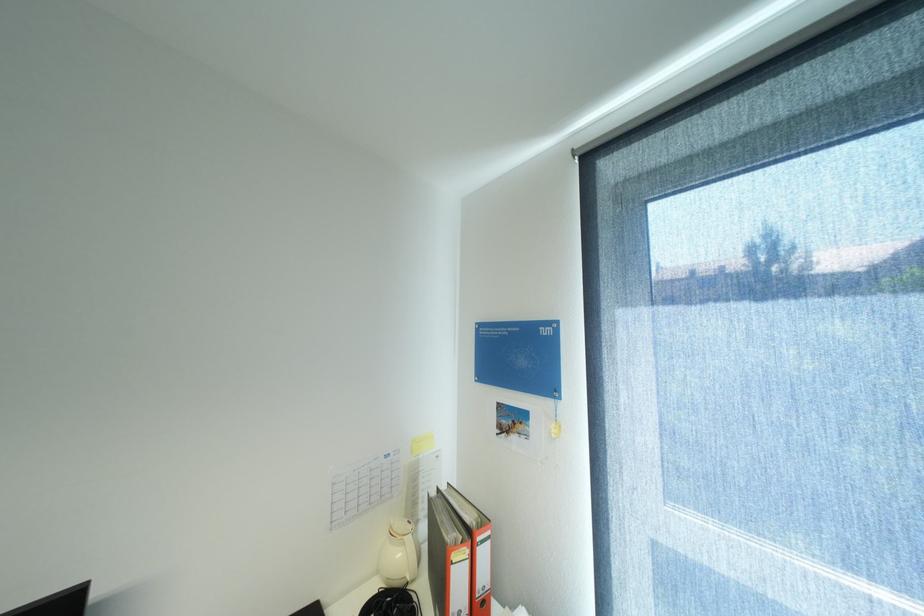
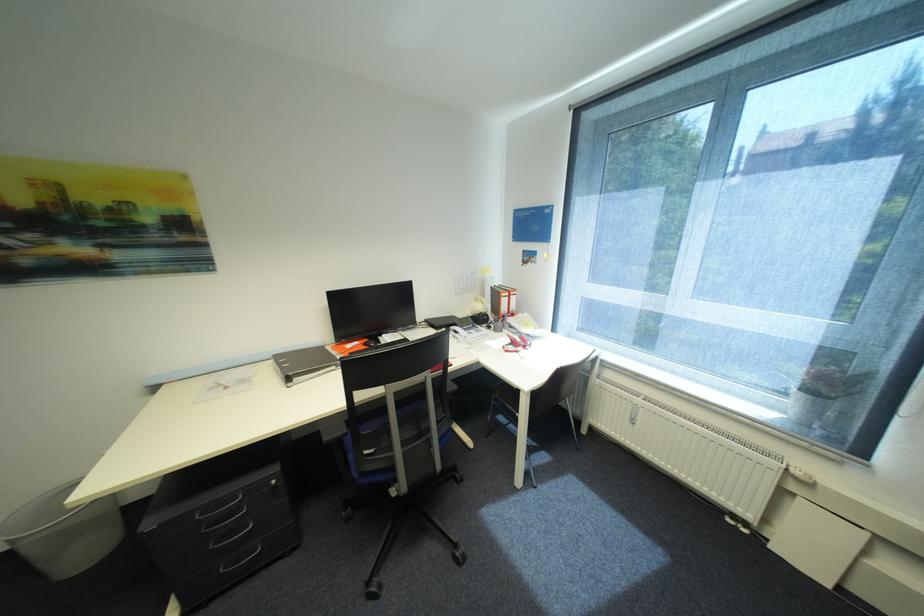
The point at (521, 438) is marked in the first image. Where is the corresponding point in the second image?

(537, 265)